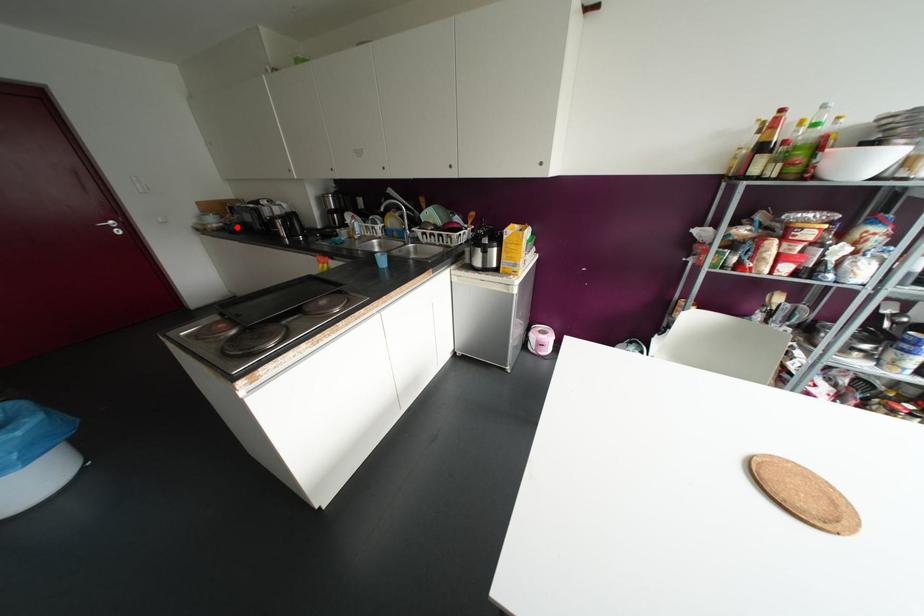
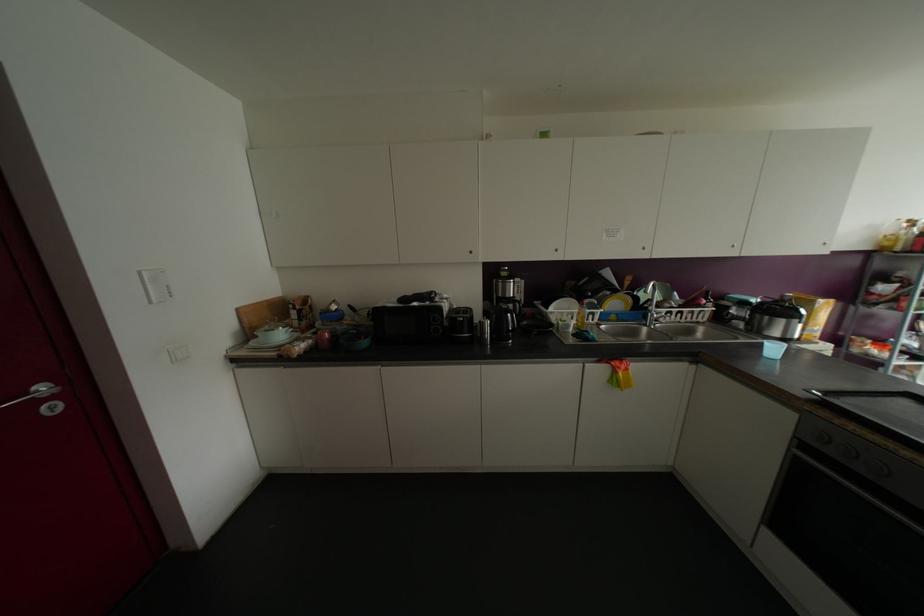
Question: I am providing you with two images of the same scene from different viewpoints. Given a red point in image1, look at the same physical point in image2. Is it:

Choices:
 (A) Closer to the viewpoint
 (B) Farther from the viewpoint

Answer: (B)